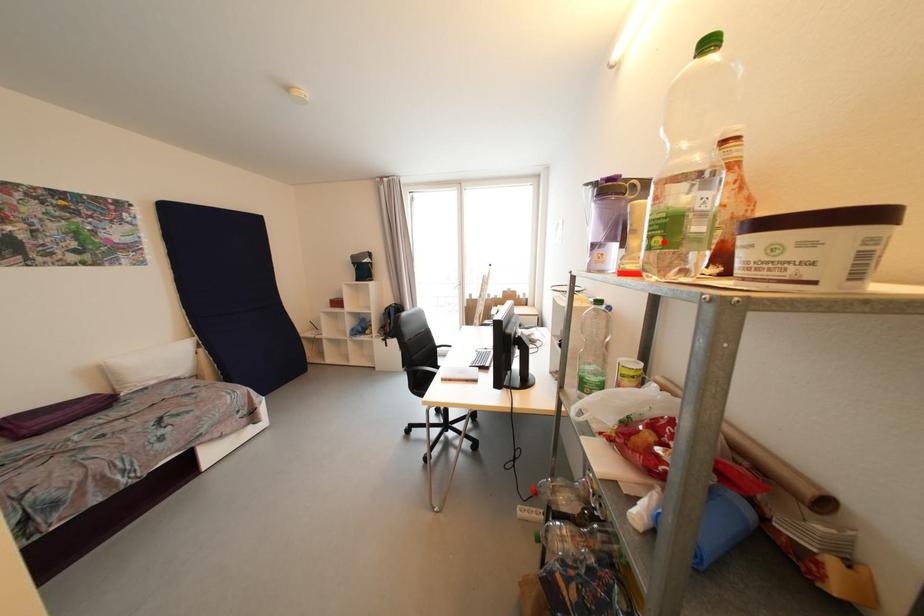
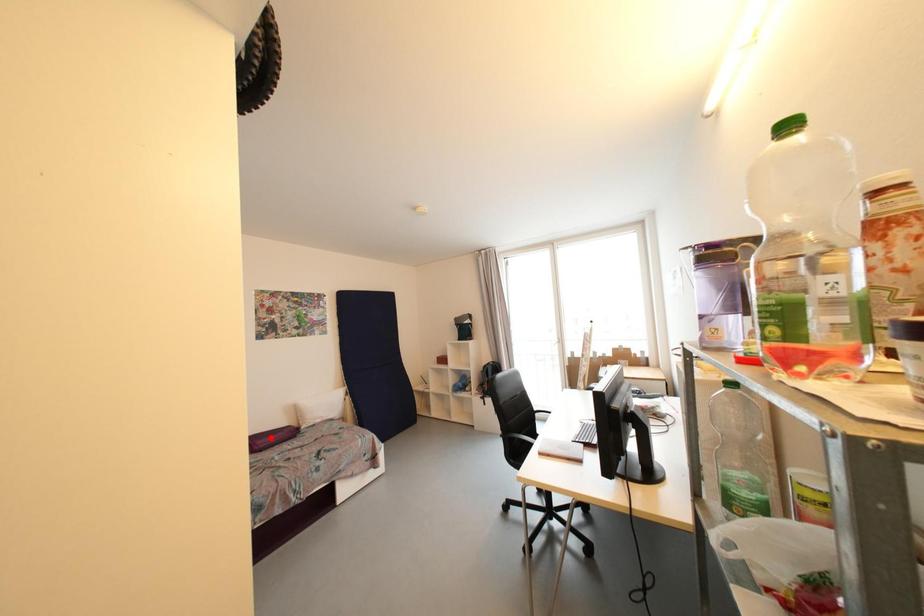
I am providing you with two images of the same scene from different viewpoints. A red point is marked on the first image and another point is marked on the second image. Do the highlighted points in image1 and image2 indicate the same real-world spot?

No